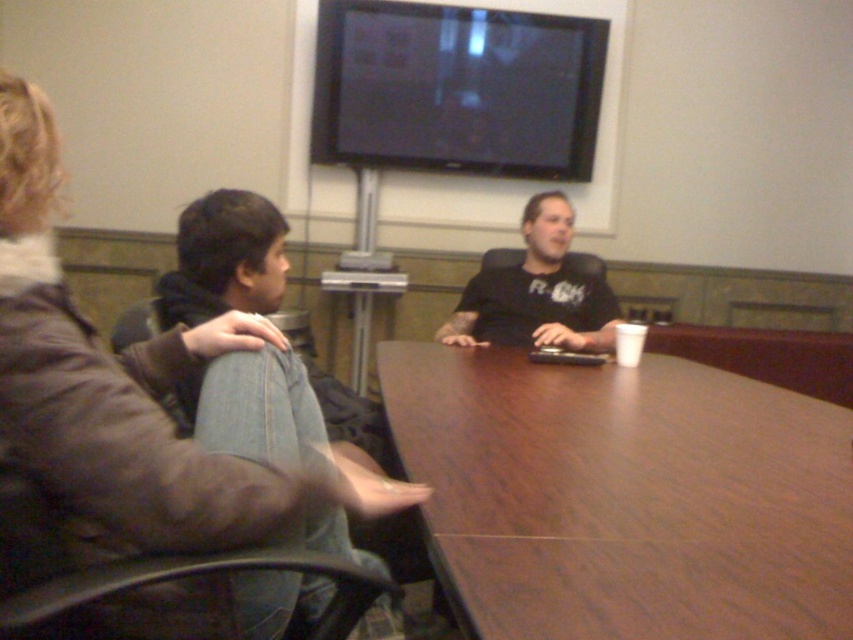
Question: Can you confirm if brown wood table at center is bigger than dark brown leather jacket at upper left?

Choices:
 (A) no
 (B) yes

Answer: (B)

Question: Among these points, which one is farthest from the camera?

Choices:
 (A) (790, 602)
 (B) (3, 493)
 (C) (537, 280)

Answer: (C)

Question: Which object is positioned closest to the dark brown leather jacket at upper left?

Choices:
 (A) brown wood table at center
 (B) black matte shirt at center

Answer: (A)

Question: Based on their relative distances, which object is nearer to the black matte shirt at center?

Choices:
 (A) brown wood table at center
 (B) dark brown leather jacket at upper left

Answer: (A)

Question: Can you confirm if dark brown leather jacket at upper left is positioned above black matte shirt at center?

Choices:
 (A) no
 (B) yes

Answer: (A)

Question: Does dark brown leather jacket at upper left have a lesser width compared to black matte shirt at center?

Choices:
 (A) yes
 (B) no

Answer: (A)